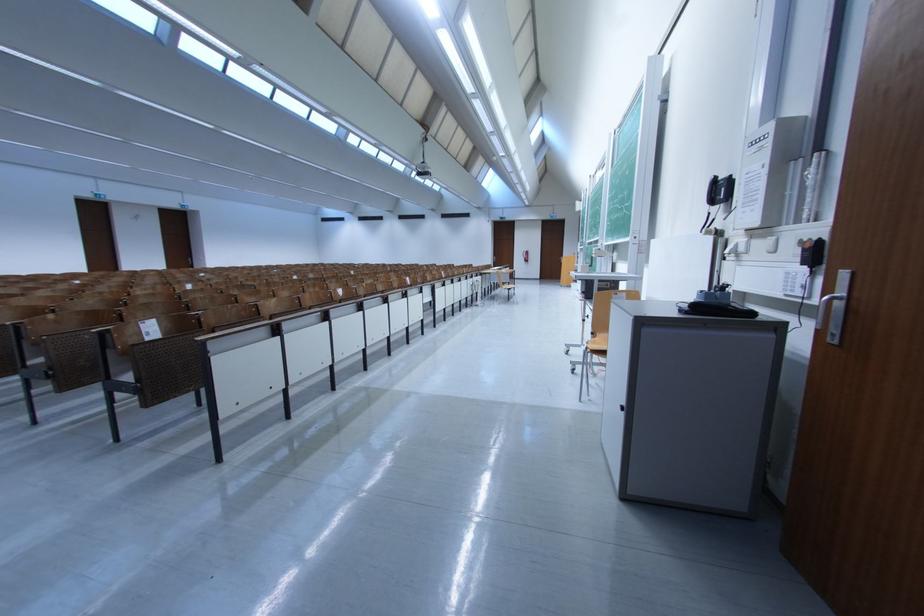
You are a GUI agent. You are given a task and a screenshot of the screen. Output one action in this format:
    pyautogui.click(x=<x>, y=<y>)
    Task: Click on the black telephone handset
    Image resolution: width=924 pixels, height=616 pixels.
    Given the screenshot: What is the action you would take?
    pyautogui.click(x=711, y=191)